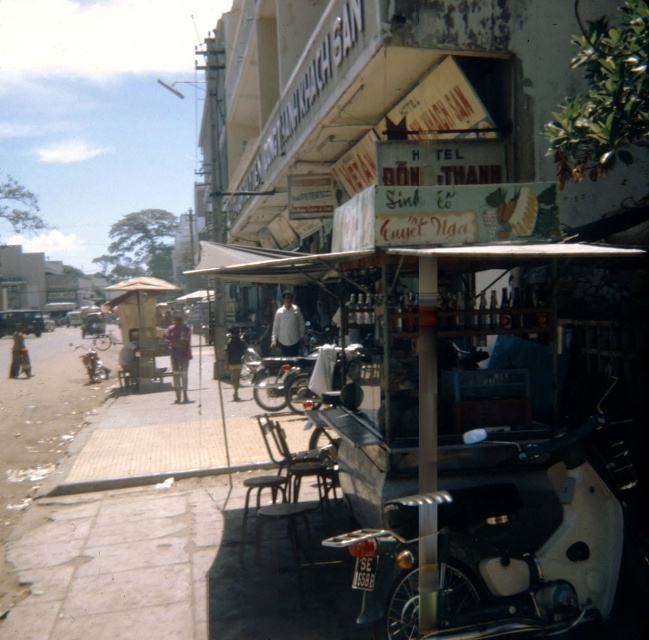
Can you confirm if white matte motorcycle at center is positioned to the right of light brown leather jacket at center?

Correct, you'll find white matte motorcycle at center to the right of light brown leather jacket at center.

Is white matte motorcycle at center positioned at the back of light brown leather jacket at center?

No, it is in front of light brown leather jacket at center.

Does point (530, 563) come closer to viewer compared to point (125, 372)?

Yes, point (530, 563) is in front of point (125, 372).

At what (x,y) coordinates should I click in order to perform the action: click on white matte motorcycle at center. Please return your answer as a coordinate pair (x, y). The image size is (649, 640). Looking at the image, I should click on tap(511, 547).

Between light brown leather jacket at center and dark blue shirt at center, which one appears on the right side from the viewer's perspective?

From the viewer's perspective, dark blue shirt at center appears more on the right side.

Does light brown leather jacket at center have a smaller size compared to dark blue shirt at center?

Actually, light brown leather jacket at center might be larger than dark blue shirt at center.

Is point (119, 353) in front of point (225, 348)?

No.

This screenshot has width=649, height=640. Find the location of `light brown leather jacket at center`. light brown leather jacket at center is located at coordinates click(x=129, y=360).

Who is more distant from viewer, (x=134, y=372) or (x=95, y=355)?

The point (x=95, y=355) is more distant.

I want to click on light brown leather jacket at center, so click(129, 360).